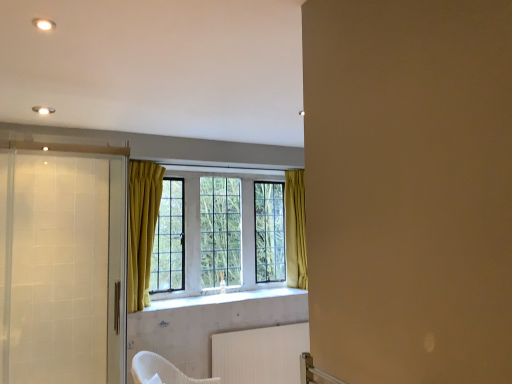
Identify the location of free spot above white textured radiator at lower center (from a real-world perspective). The height and width of the screenshot is (384, 512). (270, 325).